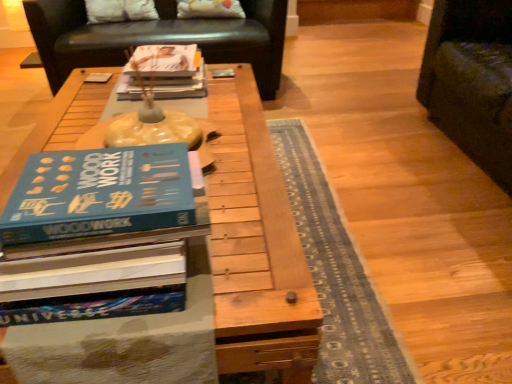
Identify the location of free region on the left part of matte paper book at center. Image resolution: width=512 pixels, height=384 pixels. (83, 96).